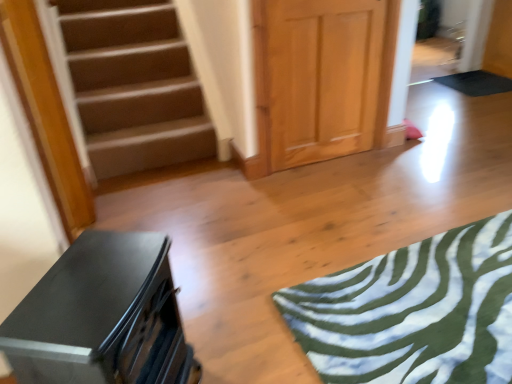
Question: From the image's perspective, is green fabric yoga mat at lower right, the 2th yoga mat from the top, located above or below matte black dresser at lower left?

Choices:
 (A) below
 (B) above

Answer: (B)

Question: Is green fabric yoga mat at lower right, which is the second yoga mat in back-to-front order, taller or shorter than matte black dresser at lower left?

Choices:
 (A) short
 (B) tall

Answer: (A)

Question: Estimate the real-world distances between objects in this image. Which object is farther from the matte black dresser at lower left?

Choices:
 (A) green fabric yoga mat at lower right, marked as the second yoga mat in a right-to-left arrangement
 (B) light wood paneling at center
 (C) black rubber yoga mat at upper right, which is counted as the first yoga mat, starting from the right

Answer: (C)

Question: Based on their relative distances, which object is farther from the matte black dresser at lower left?

Choices:
 (A) green fabric yoga mat at lower right, the 2th yoga mat from the top
 (B) light wood paneling at center
 (C) black rubber yoga mat at upper right, the 1th yoga mat when ordered from top to bottom

Answer: (C)